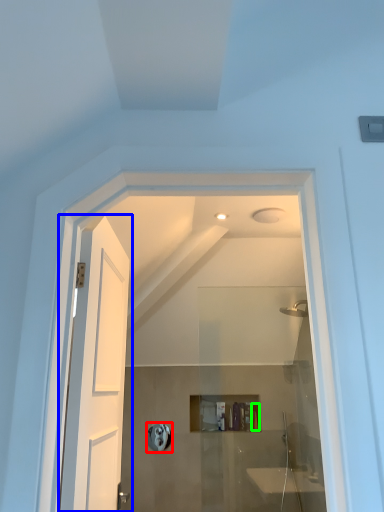
Question: Which object is the closest to the towel bar (highlighted by a red box)? Choose among these: door (highlighted by a blue box) or toiletry (highlighted by a green box).

Choices:
 (A) door
 (B) toiletry

Answer: (B)